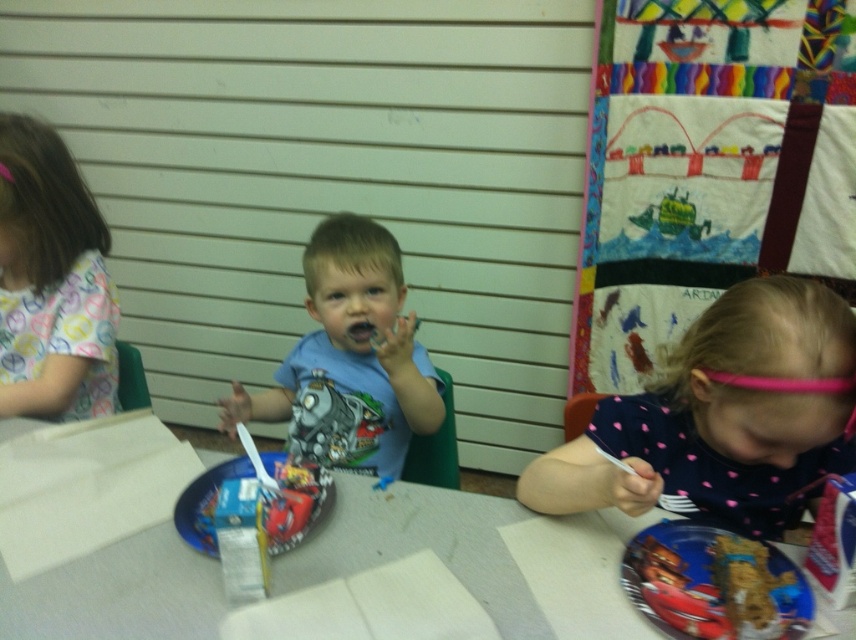
Question: Is blue cotton shirt at center closer to the viewer compared to blue plastic plate at center?

Choices:
 (A) yes
 (B) no

Answer: (B)

Question: Which point is closer to the camera?

Choices:
 (A) blue plastic plate at center
 (B) pink dotted shirt at lower right
 (C) printed fabric shirt at left
 (D) white paper at center

Answer: (B)

Question: Which object is farther from the camera taking this photo?

Choices:
 (A) white paper at center
 (B) metallic blue plate at lower right
 (C) blue plastic plate at center

Answer: (C)

Question: Where is printed fabric shirt at left located in relation to metallic blue plate at lower right in the image?

Choices:
 (A) below
 (B) above

Answer: (B)

Question: Where is pink dotted shirt at lower right located in relation to printed fabric shirt at left in the image?

Choices:
 (A) above
 (B) below

Answer: (B)

Question: Among these points, which one is nearest to the camera?

Choices:
 (A) click(x=314, y=506)
 (B) click(x=798, y=600)
 (C) click(x=391, y=305)
 (D) click(x=22, y=317)

Answer: (B)